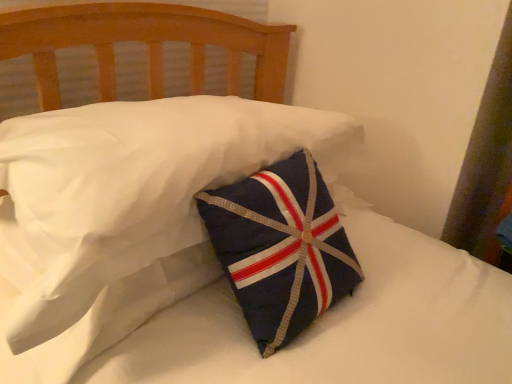
Question: Should I look upward or downward to see navy fabric pillow at center?

Choices:
 (A) down
 (B) up

Answer: (B)